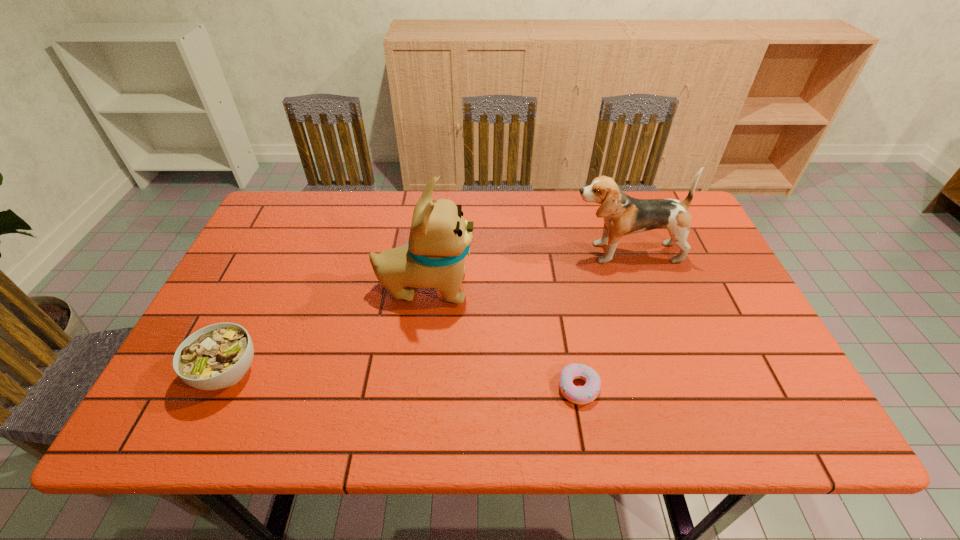
Where is `the third nearest object`? Image resolution: width=960 pixels, height=540 pixels. the third nearest object is located at coordinates (440, 237).

Locate an element on the screen. the second object from left to right is located at coordinates (440, 237).

This screenshot has width=960, height=540. In order to click on the right puppy in this screenshot , I will do `click(623, 215)`.

At what (x,y) coordinates should I click in order to perform the action: click on the farther puppy. Please return your answer as a coordinate pair (x, y). The image size is (960, 540). Looking at the image, I should click on (623, 215).

At what (x,y) coordinates should I click in order to perform the action: click on the leftmost object. Please return your answer as a coordinate pair (x, y). The height and width of the screenshot is (540, 960). Looking at the image, I should click on (217, 356).

The width and height of the screenshot is (960, 540). Find the location of `soup bowl`. soup bowl is located at coordinates (217, 356).

The width and height of the screenshot is (960, 540). Find the location of `doughnut`. doughnut is located at coordinates (585, 394).

Identify the location of vacant area situated 0.290m on the face of the second farthest object. (586, 287).

This screenshot has width=960, height=540. I want to click on free spot located at the face of the farther puppy, so click(x=472, y=253).

At what (x,y) coordinates should I click in order to perform the action: click on free space located 0.370m at the face of the farther puppy. Please return your answer as a coordinate pair (x, y). The width and height of the screenshot is (960, 540). Looking at the image, I should click on (437, 253).